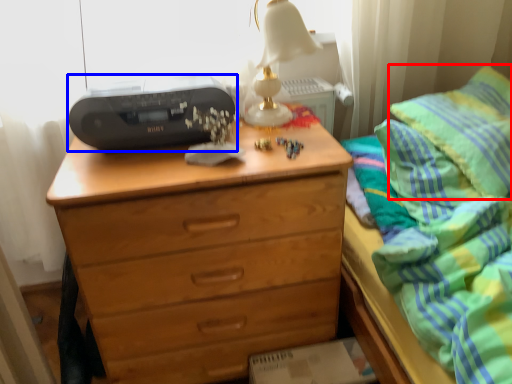
Question: Which object is further to the camera taking this photo, pillow (highlighted by a red box) or printer (highlighted by a blue box)?

Choices:
 (A) pillow
 (B) printer

Answer: (B)